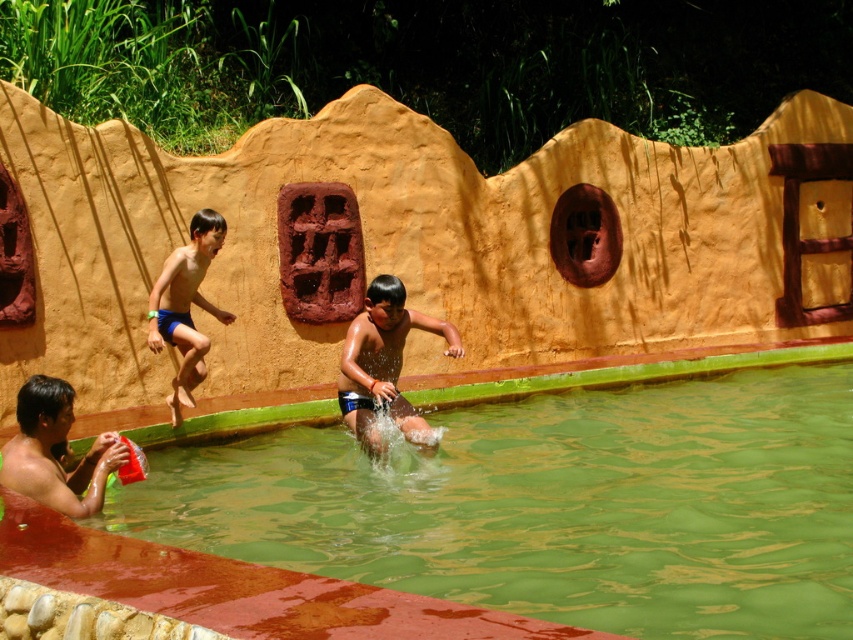
You are a lifeguard standing at the edge of the pool. You notice the green smooth water at center and the blue shorts at left. Which object is lower in height?

The green smooth water at center has a lesser height compared to the blue shorts at left, so the green smooth water at center is lower in height.

You are standing at the edge of the pool and see two points marked in the scene. Which point is closer to you, point (822, 356) or point (369, 316)?

Point (822, 356) is closer to you because it is further to the viewer than point (369, 316).